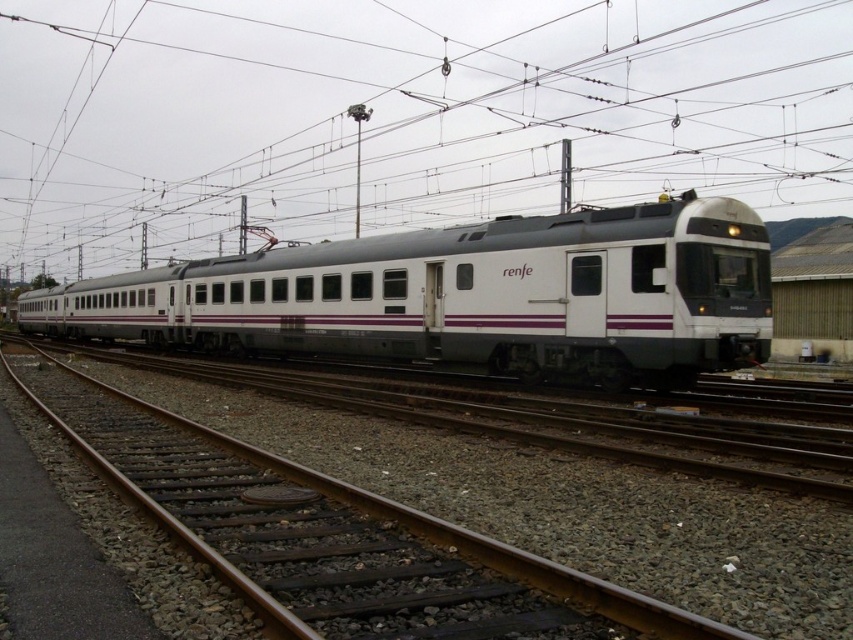
Question: Which point appears closest to the camera in this image?

Choices:
 (A) (312, 342)
 (B) (619, 170)
 (C) (157, 465)
 (D) (817, 298)

Answer: (C)

Question: Does metallic wire at upper center have a greater width compared to brown gravel track at center?

Choices:
 (A) no
 (B) yes

Answer: (B)

Question: Based on their relative distances, which object is farther from the brown gravel track at center?

Choices:
 (A) metallic gray train at center
 (B) metallic wire at upper center
 (C) white matte train at center

Answer: (B)

Question: Is metallic wire at upper center wider than metallic gray train at center?

Choices:
 (A) no
 (B) yes

Answer: (B)

Question: Can you confirm if metallic wire at upper center is positioned to the left of brown gravel track at center?

Choices:
 (A) no
 (B) yes

Answer: (A)

Question: Which of the following is the closest to the observer?

Choices:
 (A) brown gravel track at center
 (B) metallic gray train at center
 (C) white matte train at center
 (D) metallic wire at upper center

Answer: (A)